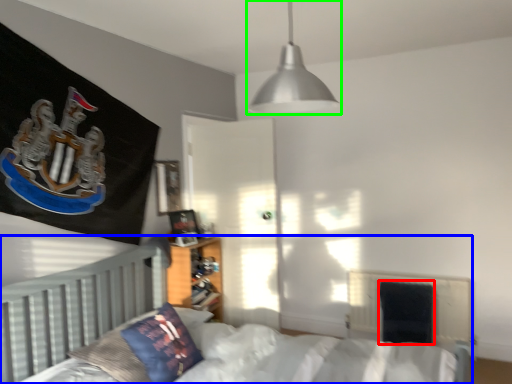
Question: Considering the real-world distances, which object is closest to armchair (highlighted by a red box)? bed (highlighted by a blue box) or lamp (highlighted by a green box).

Choices:
 (A) bed
 (B) lamp

Answer: (A)